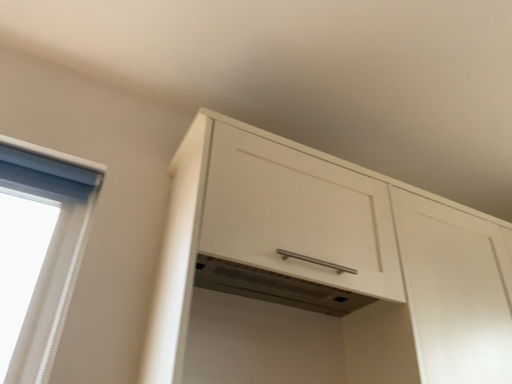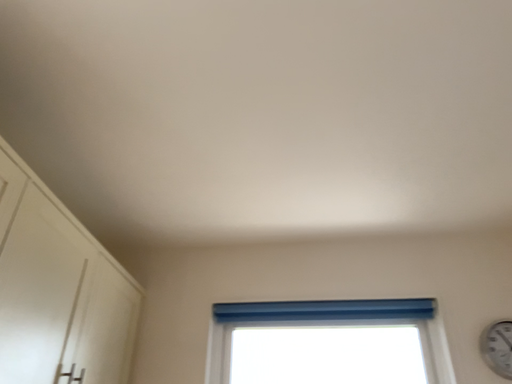
Question: Which way did the camera rotate in the video?

Choices:
 (A) rotated right
 (B) rotated left

Answer: (A)